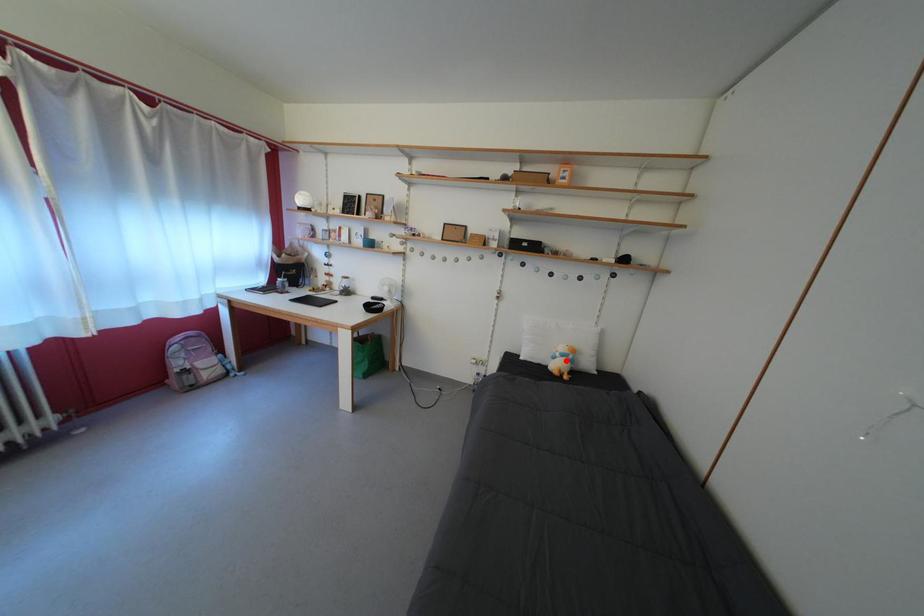
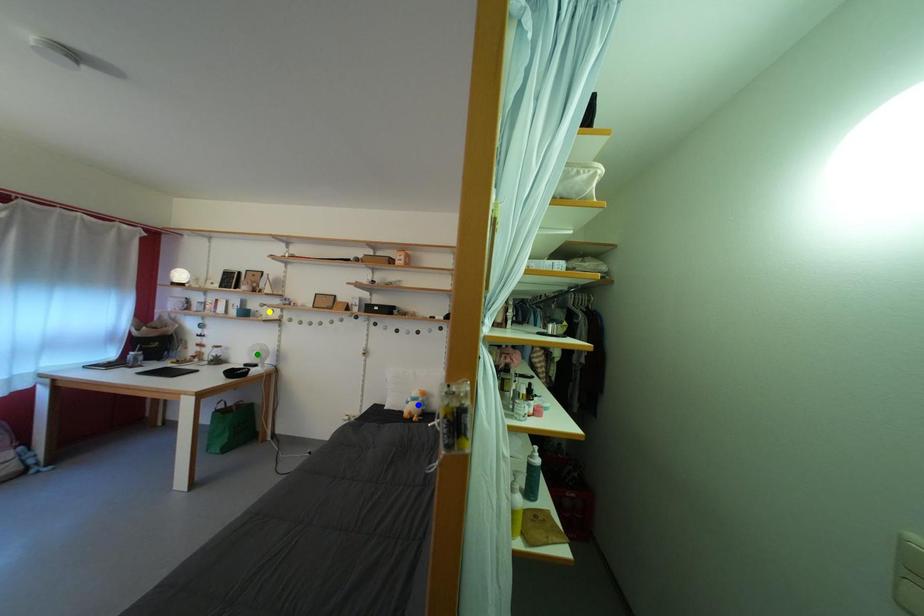
Question: I am providing you with two images of the same scene from different viewpoints. A red point is marked on the first image. You are given multiple points on the second image. Which spot in image 2 lines up with the point in image 1?

Choices:
 (A) green point
 (B) yellow point
 (C) blue point

Answer: (C)